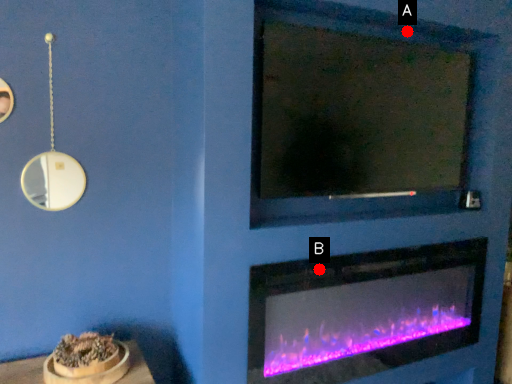
Question: Two points are circled on the image, labeled by A and B beside each circle. Which of the following is the farthest from the observer?

Choices:
 (A) A is further
 (B) B is further

Answer: (A)